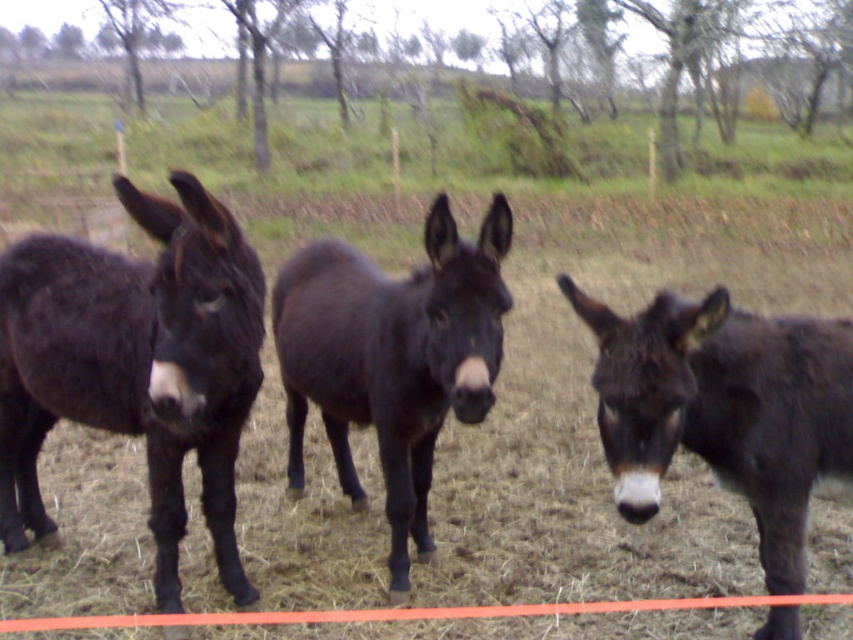
Question: Is dark brown fur mule at center below shiny dark brown mule at center?

Choices:
 (A) no
 (B) yes

Answer: (B)

Question: Can you confirm if dark brown fur mule at center is thinner than shiny dark brown mule at center?

Choices:
 (A) yes
 (B) no

Answer: (B)

Question: Which object is farther from the camera taking this photo?

Choices:
 (A) shiny dark brown mule at center
 (B) dark brown fur mule at center
 (C) shiny black mule at left

Answer: (A)

Question: Which point is closer to the camera?

Choices:
 (A) shiny black mule at left
 (B) dark brown fur mule at center
 (C) shiny dark brown mule at center

Answer: (B)

Question: Which of the following is the farthest from the observer?

Choices:
 (A) (747, 349)
 (B) (318, 310)
 (C) (143, 394)

Answer: (B)

Question: Does shiny black mule at left have a lesser width compared to shiny dark brown mule at center?

Choices:
 (A) no
 (B) yes

Answer: (A)